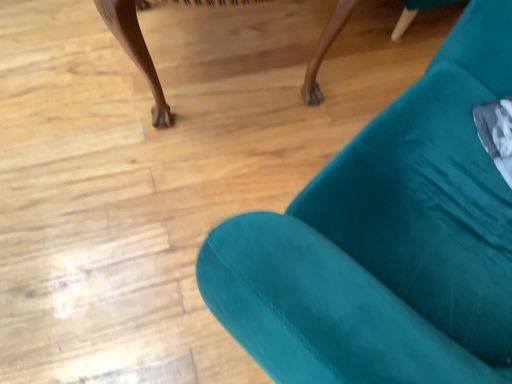
Question: From a real-world perspective, is velvet teal armchair at upper right positioned under teal fabric chair at lower right based on gravity?

Choices:
 (A) no
 (B) yes

Answer: (A)

Question: Does velvet teal armchair at upper right appear on the left side of teal fabric chair at lower right?

Choices:
 (A) no
 (B) yes

Answer: (A)

Question: Is the surface of velvet teal armchair at upper right in direct contact with teal fabric chair at lower right?

Choices:
 (A) no
 (B) yes

Answer: (A)

Question: Are velvet teal armchair at upper right and teal fabric chair at lower right located far from each other?

Choices:
 (A) yes
 (B) no

Answer: (B)

Question: Does velvet teal armchair at upper right have a lesser height compared to teal fabric chair at lower right?

Choices:
 (A) yes
 (B) no

Answer: (B)

Question: From a real-world perspective, is velvet teal armchair at upper right on teal fabric chair at lower right?

Choices:
 (A) yes
 (B) no

Answer: (A)

Question: Considering the relative sizes of teal fabric chair at lower right and velvet teal armchair at upper right in the image provided, is teal fabric chair at lower right smaller than velvet teal armchair at upper right?

Choices:
 (A) yes
 (B) no

Answer: (A)

Question: Is teal fabric chair at lower right not close to velvet teal armchair at upper right?

Choices:
 (A) no
 (B) yes

Answer: (A)

Question: From the image's perspective, is teal fabric chair at lower right on velvet teal armchair at upper right?

Choices:
 (A) yes
 (B) no

Answer: (A)

Question: Is teal fabric chair at lower right positioned with its back to velvet teal armchair at upper right?

Choices:
 (A) yes
 (B) no

Answer: (B)

Question: Considering the relative sizes of teal fabric chair at lower right and velvet teal armchair at upper right in the image provided, is teal fabric chair at lower right bigger than velvet teal armchair at upper right?

Choices:
 (A) no
 (B) yes

Answer: (A)

Question: Is teal fabric chair at lower right to the left of velvet teal armchair at upper right from the viewer's perspective?

Choices:
 (A) no
 (B) yes

Answer: (B)

Question: In terms of height, does velvet teal armchair at upper right look taller or shorter compared to teal fabric chair at lower right?

Choices:
 (A) short
 (B) tall

Answer: (B)